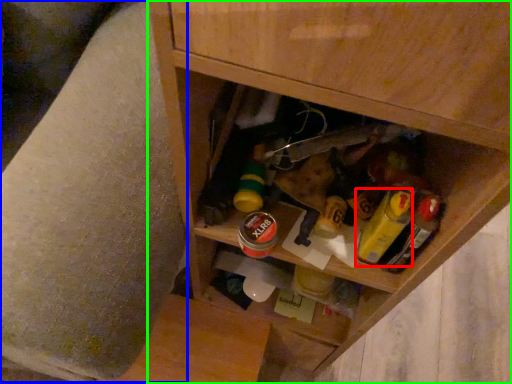
Question: Which object is the farthest from mustard (highlighted by a red box)? Choose among these: swivel chair (highlighted by a blue box) or cabinetry (highlighted by a green box).

Choices:
 (A) swivel chair
 (B) cabinetry

Answer: (A)